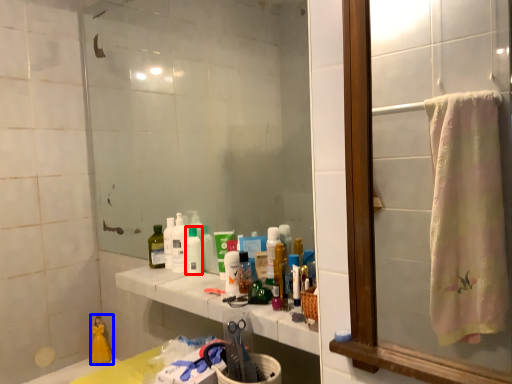
Question: Which point is closer to the camera, mouthwash (highlighted by a red box) or product (highlighted by a blue box)?

Choices:
 (A) mouthwash
 (B) product

Answer: (A)